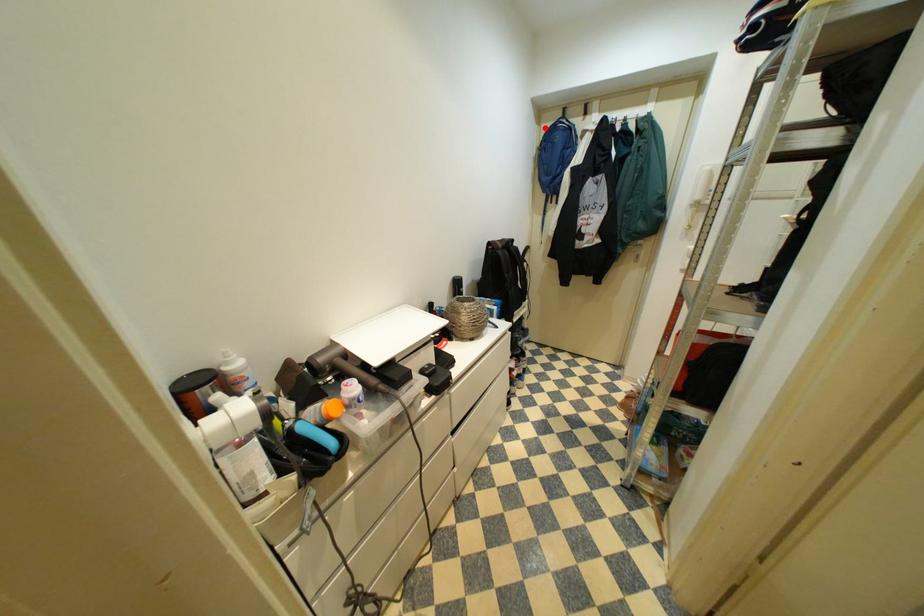
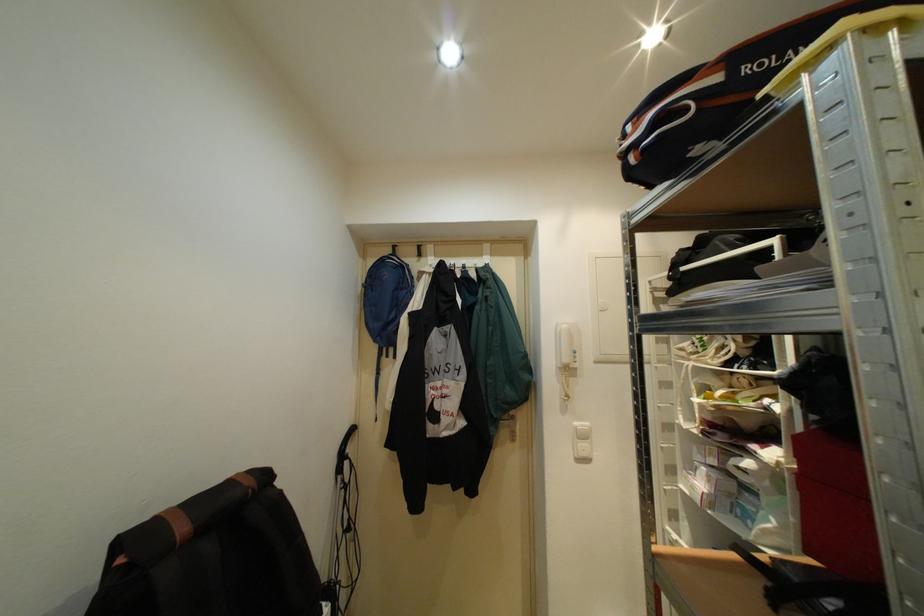
The point at the highlighted location is marked in the first image. Where is the corresponding point in the second image?

(370, 262)